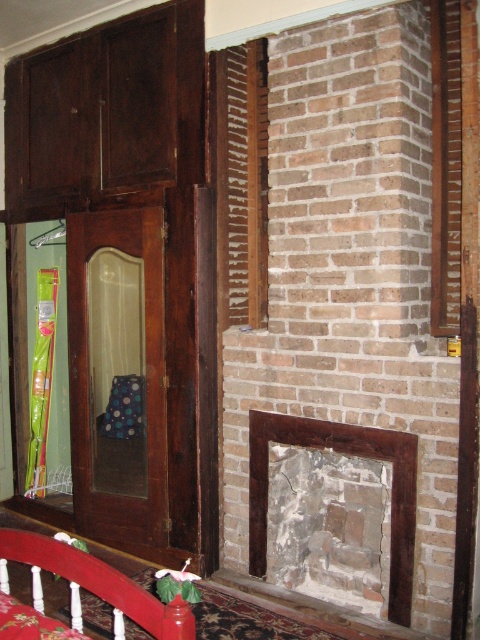
Does wooden slats at center appear over red wood bed rail at lower left?

Yes.

Is point (260, 109) in front of point (46, 568)?

No, (260, 109) is further to viewer.

Is point (232, 92) positioned before point (73, 570)?

No, it is not.

This screenshot has width=480, height=640. What are the coordinates of `wooden slats at center` in the screenshot? It's located at (241, 182).

Between point (251, 454) and point (4, 548), which one is positioned behind?

The point (251, 454) is more distant.

Based on the photo, who is more distant from viewer, (x=255, y=554) or (x=116, y=589)?

The point (x=255, y=554) is behind.

This screenshot has height=640, width=480. Identify the location of rustic stone fireplace at center. (348, 452).

Who is shorter, wooden slats at center or rustic stone fireplace at center?

rustic stone fireplace at center

Is wooden slats at center further to camera compared to rustic stone fireplace at center?

Yes.

Between point (249, 198) and point (414, 481), which one is positioned behind?

Point (249, 198)

Locate an element on the screen. This screenshot has height=640, width=480. wooden slats at center is located at coordinates (x=241, y=182).